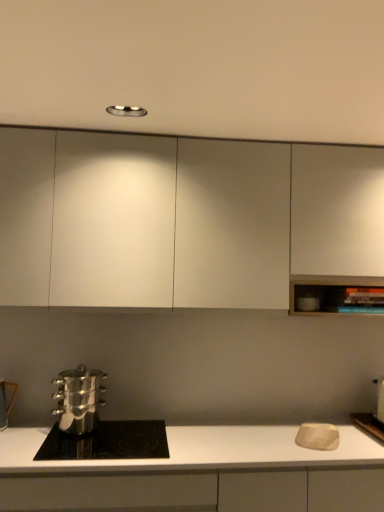
Question: Do you think polished stainless steel pot at lower left is within polished stainless steel steamer at lower left, or outside of it?

Choices:
 (A) outside
 (B) inside

Answer: (A)

Question: From their relative heights in the image, would you say polished stainless steel pot at lower left is taller or shorter than polished stainless steel steamer at lower left?

Choices:
 (A) short
 (B) tall

Answer: (A)

Question: Estimate the real-world distances between objects in this image. Which object is closer to the white matte countertop at lower center, acting as the first cabinetry starting from the bottom?

Choices:
 (A) polished stainless steel steamer at lower left
 (B) polished stainless steel pot at lower left
 (C) matte white cutting board at right, positioned as the 1th appliance in right-to-left order
 (D) white matte cabinet at upper center, which is the 1th cabinetry in top-to-bottom order
 (E) metallic silver pot at lower left, positioned as the first appliance in left-to-right order

Answer: (B)

Question: Which object is positioned closest to the polished stainless steel steamer at lower left?

Choices:
 (A) polished stainless steel pot at lower left
 (B) matte white cutting board at right, positioned as the 1th appliance in right-to-left order
 (C) white matte cabinet at upper center, which is the 2th cabinetry in bottom-to-top order
 (D) white matte countertop at lower center, acting as the first cabinetry starting from the bottom
 (E) metallic silver pot at lower left, positioned as the first appliance in left-to-right order

Answer: (A)